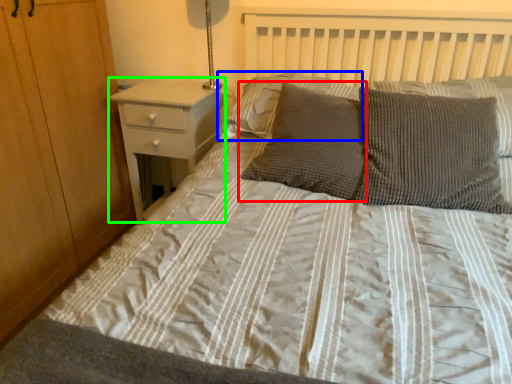
Question: Based on their relative distances, which object is nearer to pillow (highlighted by a red box)? Choose from pillow (highlighted by a blue box) and nightstand (highlighted by a green box).

Choices:
 (A) pillow
 (B) nightstand

Answer: (A)